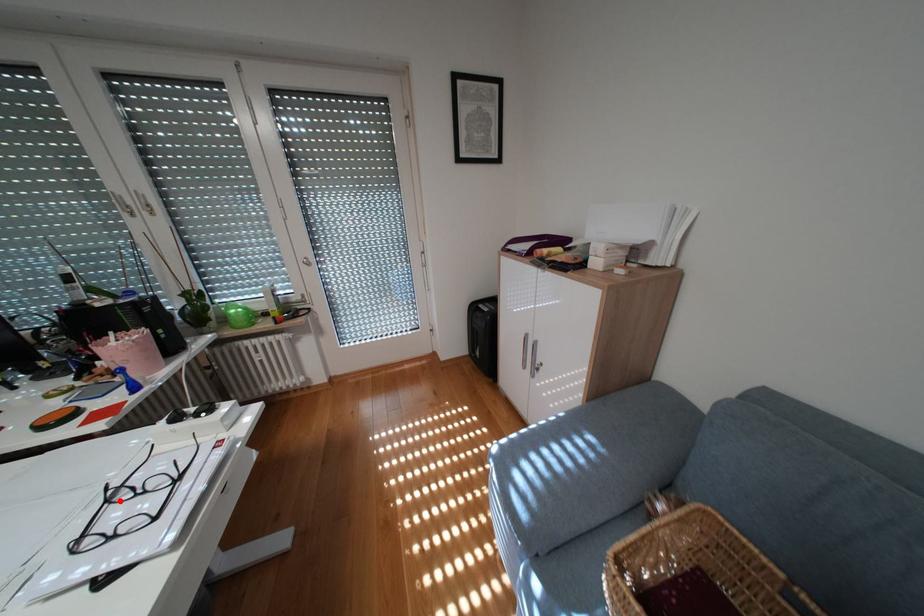
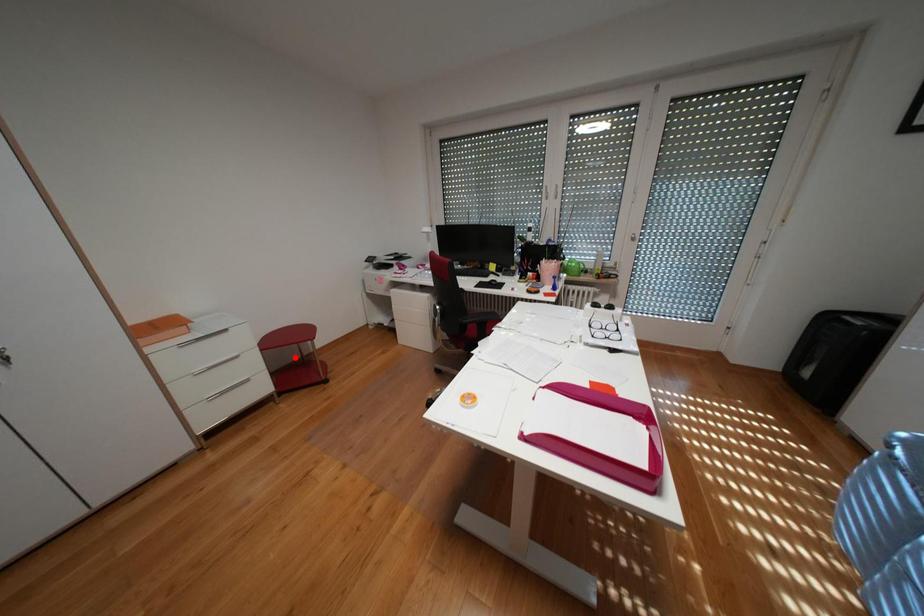
I am providing you with two images of the same scene from different viewpoints. A red point is marked on the first image and another point is marked on the second image. Are the points marked in image1 and image2 representing the same 3D position?

No